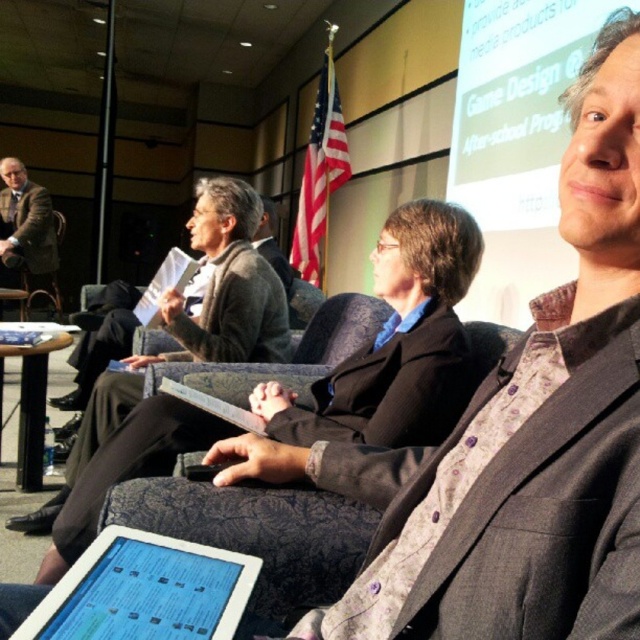
Question: Which of the following is the farthest from the observer?

Choices:
 (A) dark gray textured blazer at center
 (B) matte brown suit at left
 (C) white glossy tablet at lower left
 (D) dark gray wool suit at center

Answer: (B)

Question: Is dark gray textured blazer at center positioned behind dark gray wool suit at center?

Choices:
 (A) no
 (B) yes

Answer: (A)

Question: Which object is the closest to the matte brown suit at left?

Choices:
 (A) dark gray wool suit at center
 (B) white glossy tablet at lower left

Answer: (A)

Question: Is dark gray textured blazer at center positioned behind matte brown suit at left?

Choices:
 (A) yes
 (B) no

Answer: (B)

Question: Which point appears farthest from the camera in this image?

Choices:
 (A) (42, 269)
 (B) (497, 548)
 (C) (145, 570)

Answer: (A)

Question: Can you confirm if dark gray textured blazer at center is wider than white glossy tablet at lower left?

Choices:
 (A) yes
 (B) no

Answer: (B)